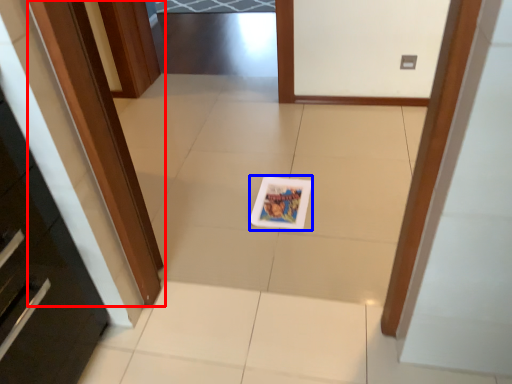
Question: Which of the following is the farthest to the observer, door (highlighted by a red box) or postcard (highlighted by a blue box)?

Choices:
 (A) door
 (B) postcard

Answer: (B)